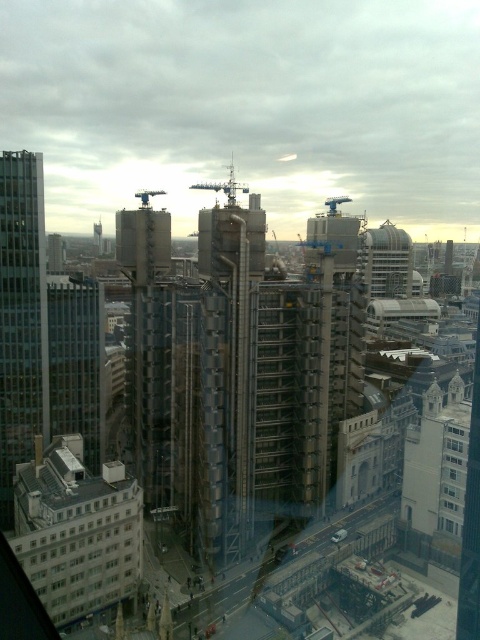
You are an architect reviewing this cityscape design. You need to determine the spatial relationship between the glassy steel tower at upper right and the clear glass windows at center. Based on the scene, which one is positioned higher in the image?

The glassy steel tower at upper right is positioned higher than the clear glass windows at center in the image.

Based on the photo, you are standing at the center of the city and looking at the two points in the image. Which point is closer to you, the point at coordinates point (x=28, y=387) or point (x=223, y=192)?

Point (x=28, y=387) is in front of point (x=223, y=192), so it is closer to you.

You are standing at point (21, 317) in the cityscape. What type of building do you see at that location?

At point (21, 317) lies glassy reflective skyscraper at left.